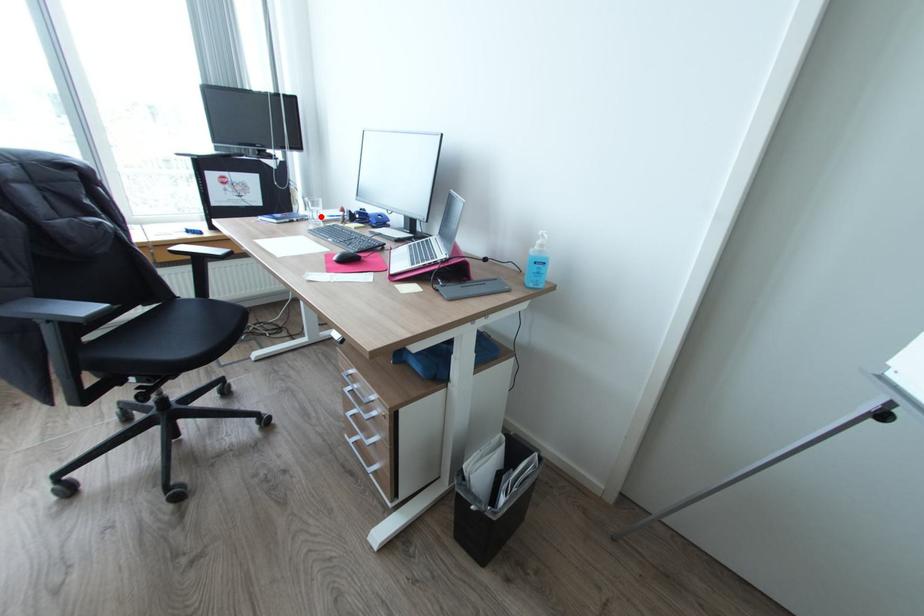
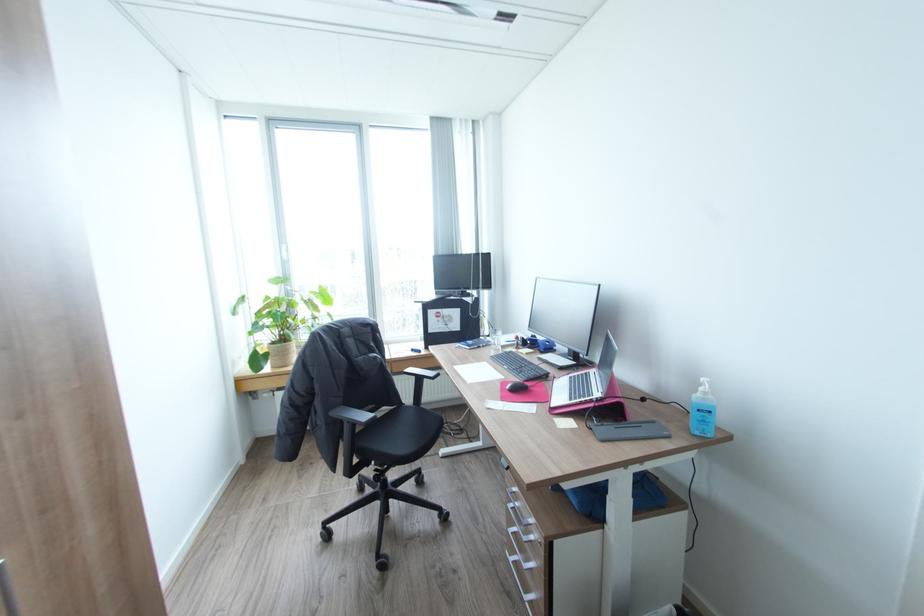
Where in the second image is the point corresponding to the highlighted location from the first image?

(502, 344)